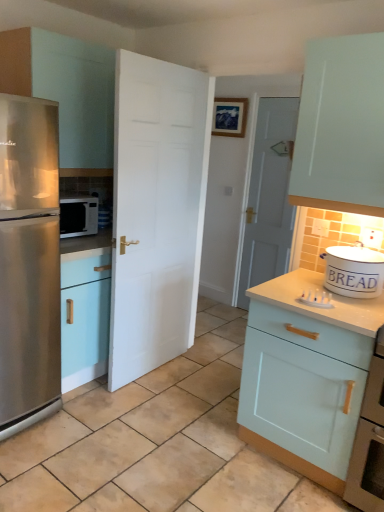
Identify the location of free spot below white matte door at center, which ranks as the 2th door in right-to-left order (from a real-world perspective). (153, 370).